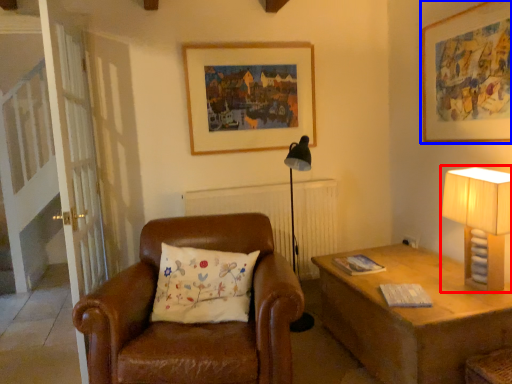
Question: Which point is further to the camera, table lamp (highlighted by a red box) or picture frame (highlighted by a blue box)?

Choices:
 (A) table lamp
 (B) picture frame

Answer: (B)